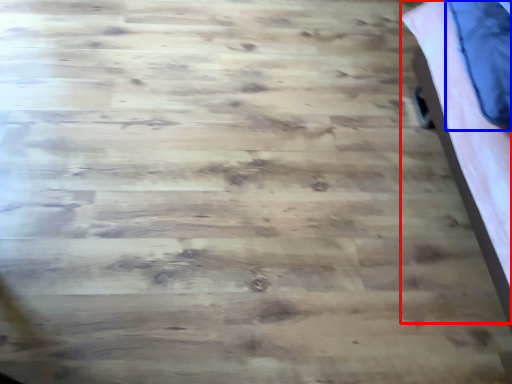
Question: Which object appears farthest to the camera in this image, bed (highlighted by a red box) or pillow (highlighted by a blue box)?

Choices:
 (A) bed
 (B) pillow

Answer: (B)